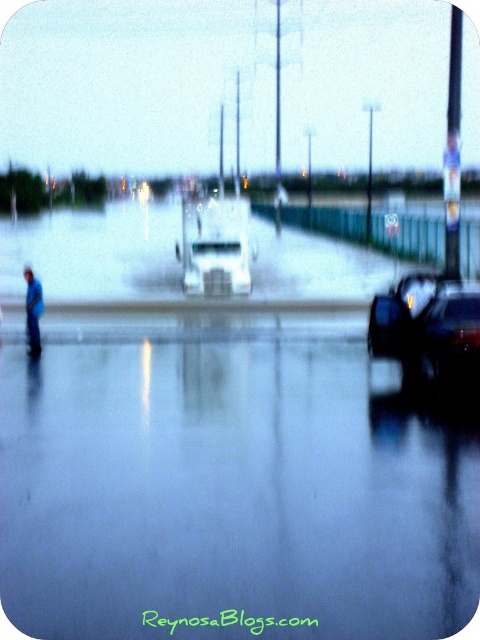
Between glossy reflective water at lower center and blue fabric person at left, which one appears on the right side from the viewer's perspective?

From the viewer's perspective, glossy reflective water at lower center appears more on the right side.

Which is in front, point (152, 620) or point (33, 332)?

Point (152, 620) is in front.

Is point (442, 545) farther from viewer compared to point (27, 296)?

No, (442, 545) is closer to viewer.

Identify the location of glossy reflective water at lower center. (229, 492).

Does glossy reflective water at lower center lie behind shiny black car at lower right?

No, glossy reflective water at lower center is in front of shiny black car at lower right.

Is glossy reflective water at lower center bigger than shiny black car at lower right?

Yes, glossy reflective water at lower center is bigger than shiny black car at lower right.

In order to click on glossy reflective water at lower center in this screenshot , I will do `click(229, 492)`.

You are a GUI agent. You are given a task and a screenshot of the screen. Output one action in this format:
    pyautogui.click(x=<x>, y=<y>)
    Task: Click on the glossy reflective water at lower center
    This screenshot has height=640, width=480.
    Given the screenshot: What is the action you would take?
    pyautogui.click(x=229, y=492)

Based on the photo, who is lower down, shiny black car at lower right or blue fabric person at left?

Positioned lower is shiny black car at lower right.

Which is more to the right, shiny black car at lower right or blue fabric person at left?

Positioned to the right is shiny black car at lower right.

Between point (454, 321) and point (33, 301), which one is positioned behind?

The point (33, 301) is behind.

I want to click on shiny black car at lower right, so click(429, 332).